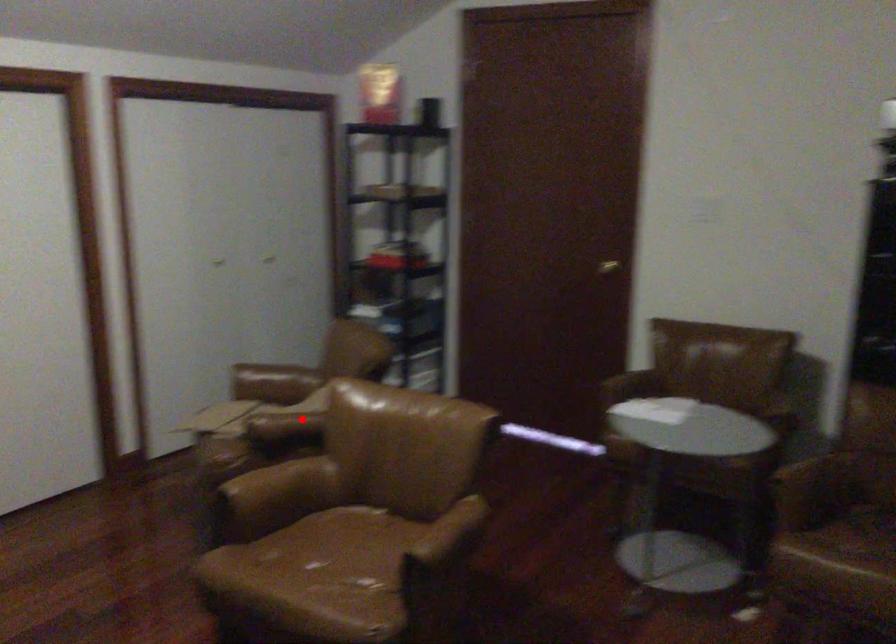
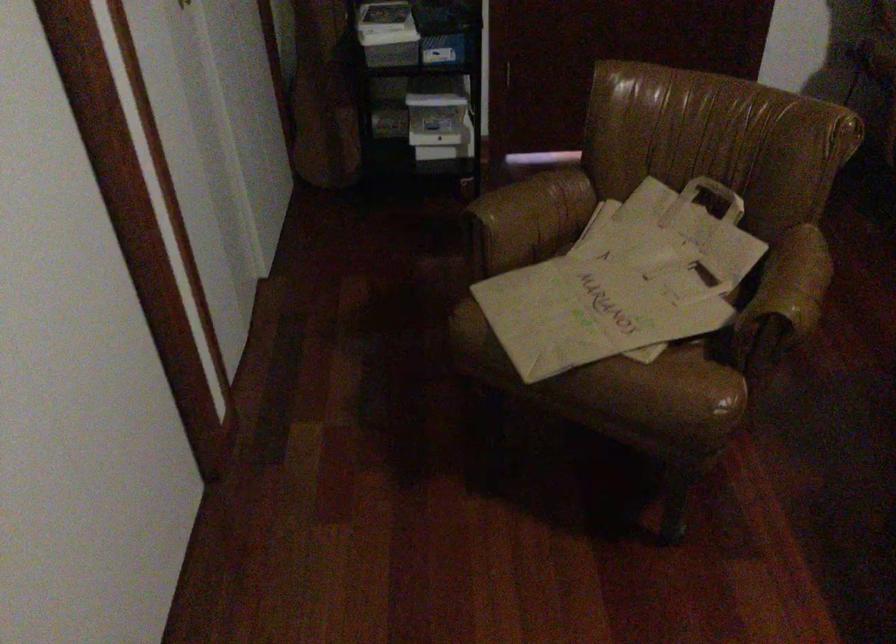
The point at the highlighted location is marked in the first image. Where is the corresponding point in the second image?

(803, 275)